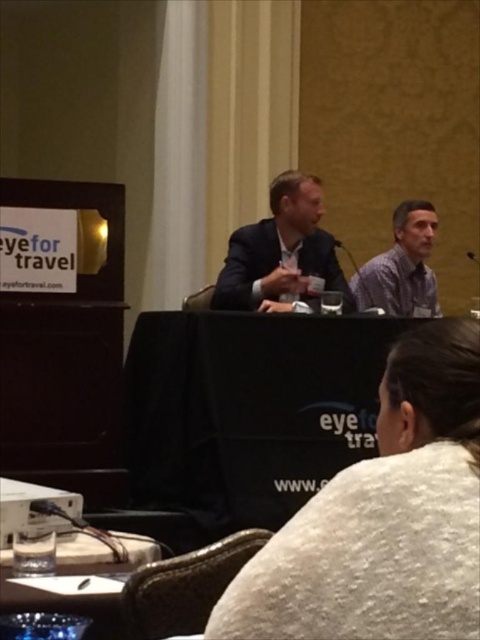
Does white fuzzy sweater at lower center appear over matte black suit at center?

Actually, white fuzzy sweater at lower center is below matte black suit at center.

Consider the image. Who is more distant from viewer, [427,342] or [280,184]?

The point [280,184] is behind.

What do you see at coordinates (384, 516) in the screenshot? This screenshot has width=480, height=640. I see `white fuzzy sweater at lower center` at bounding box center [384, 516].

I want to click on white fuzzy sweater at lower center, so click(x=384, y=516).

Based on the photo, is white fuzzy sweater at lower center behind gray fabric shirt at right?

No.

How far apart are white fuzzy sweater at lower center and gray fabric shirt at right?

white fuzzy sweater at lower center is 10.44 feet from gray fabric shirt at right.

Who is more forward, (446, 576) or (411, 216)?

Point (446, 576) is more forward.

I want to click on white fuzzy sweater at lower center, so click(x=384, y=516).

Which is more to the left, matte black suit at center or gray fabric shirt at right?

Positioned to the left is matte black suit at center.

Can you confirm if matte black suit at center is positioned to the right of gray fabric shirt at right?

No, matte black suit at center is not to the right of gray fabric shirt at right.

Where is `matte black suit at center`? Image resolution: width=480 pixels, height=640 pixels. matte black suit at center is located at coordinates (282, 253).

Where is `matte black suit at center`? matte black suit at center is located at coordinates (282, 253).